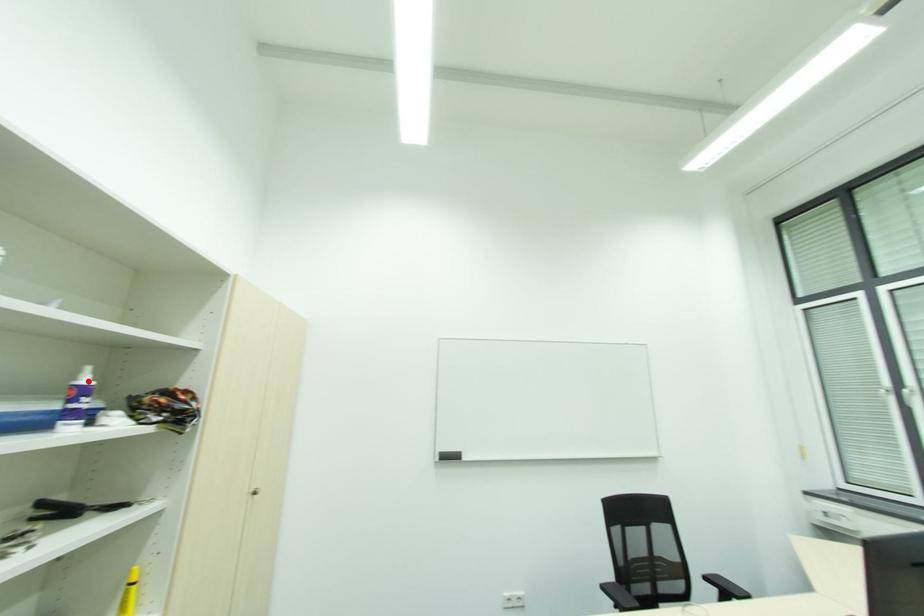
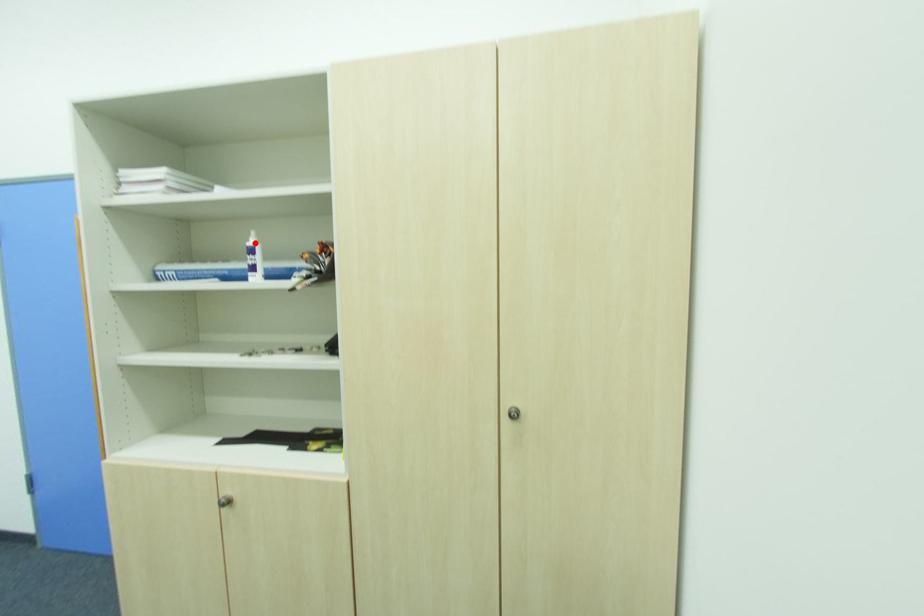
I am providing you with two images of the same scene from different viewpoints. A red point is marked on the first image and another point is marked on the second image. Does the point marked in image1 correspond to the same location as the one in image2?

Yes